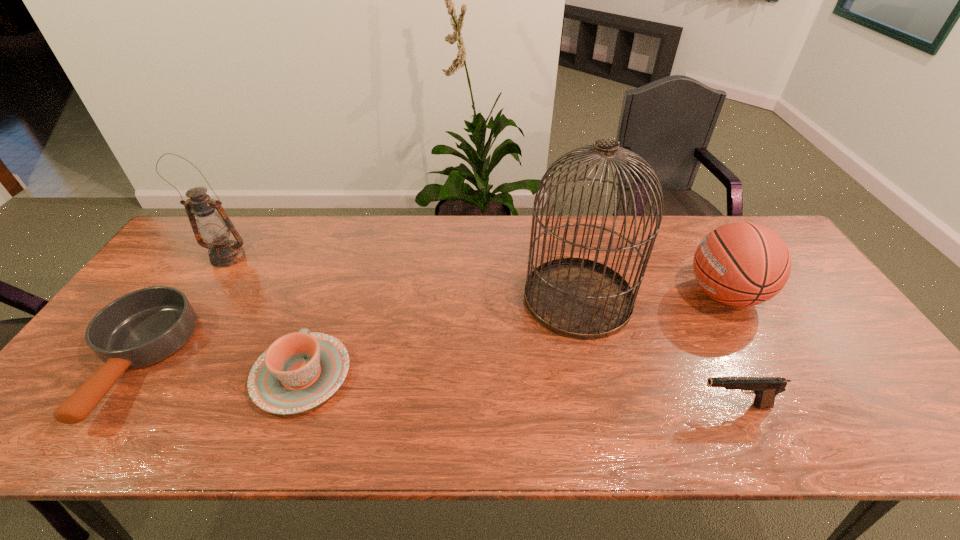
Where is `vacant area located on the logo side of the basketball`? vacant area located on the logo side of the basketball is located at coordinates tap(650, 294).

Where is `vacant space situated on the logo side of the basketball`? Image resolution: width=960 pixels, height=540 pixels. vacant space situated on the logo side of the basketball is located at coordinates (619, 294).

Find the location of `free spot located at the muzzle of the pistol`. free spot located at the muzzle of the pistol is located at coordinates (594, 406).

Locate an element on the screen. vacant space located at the muzzle of the pistol is located at coordinates (616, 406).

Locate an element on the screen. vacant space located 0.230m at the muzzle of the pistol is located at coordinates (594, 406).

Identify the location of vacant region located on the handle side of the fourth object from right to left. Image resolution: width=960 pixels, height=540 pixels. (340, 266).

Locate an element on the screen. free location located on the handle side of the fourth object from right to left is located at coordinates (327, 301).

Locate an element on the screen. This screenshot has width=960, height=540. vacant space situated 0.330m on the handle side of the fourth object from right to left is located at coordinates (344, 256).

Locate an element on the screen. The image size is (960, 540). object that is at the far edge is located at coordinates click(213, 226).

Where is `pistol present at the near edge`? The height and width of the screenshot is (540, 960). pistol present at the near edge is located at coordinates (765, 389).